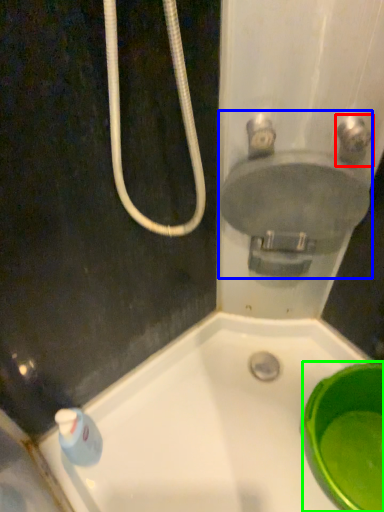
Question: Which object is the closest to the plumbing fixture (highlighted by a red box)? Choose among these: sink (highlighted by a blue box) or basin (highlighted by a green box).

Choices:
 (A) sink
 (B) basin

Answer: (A)